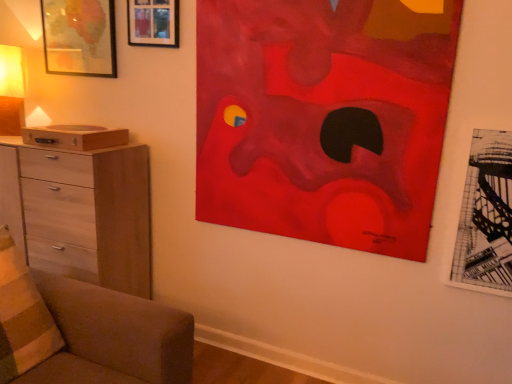
Where is `free point below matte red abstract painting at upper right (from a real-world perspective)`? Image resolution: width=512 pixels, height=384 pixels. free point below matte red abstract painting at upper right (from a real-world perspective) is located at coordinates (303, 348).